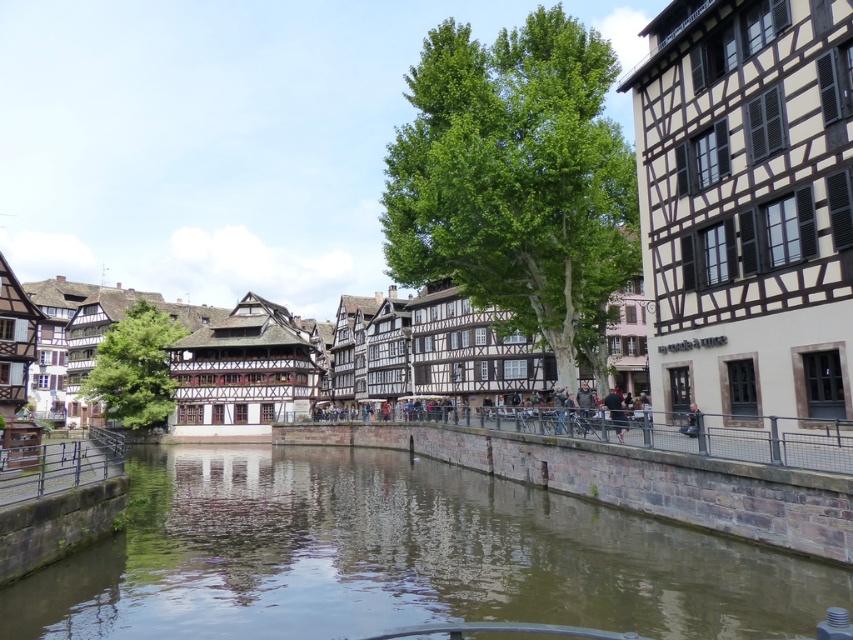
Can you confirm if white timber-framed building at center is positioned below brown stone river at center?

Actually, white timber-framed building at center is above brown stone river at center.

What do you see at coordinates (207, 141) in the screenshot? I see `white timber-framed building at center` at bounding box center [207, 141].

Where is `white timber-framed building at center`? The image size is (853, 640). white timber-framed building at center is located at coordinates (207, 141).

Which of these two, white timber-framed building at center or rustic metal railing at lower left, stands taller?

Standing taller between the two is white timber-framed building at center.

Locate an element on the screen. white timber-framed building at center is located at coordinates (207, 141).

Find the location of `white timber-framed building at center`. white timber-framed building at center is located at coordinates (207, 141).

The height and width of the screenshot is (640, 853). Describe the element at coordinates (346, 360) in the screenshot. I see `white wood timbered house at center` at that location.

I want to click on white wood timbered house at center, so click(346, 360).